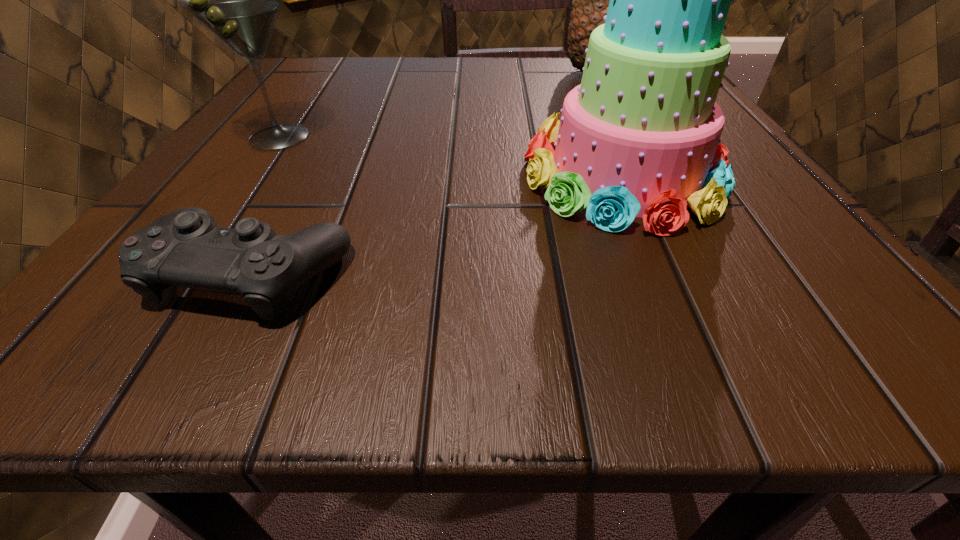
Find the location of `free spot between the martini and the tallest object`. free spot between the martini and the tallest object is located at coordinates (436, 105).

Identify the location of object that is the third nearest to the pineapple. (186, 248).

Select which object is the third closest to the shortest object. Please provide its 2D coordinates. Your answer should be formatted as a tuple, i.e. [(x, y)], where the tuple contains the x and y coordinates of a point satisfying the conditions above.

[(590, 3)]

At what (x,y) coordinates should I click in order to perform the action: click on vacant space that satisfies the following two spatial constraints: 1. on the back side of the cake; 2. on the left side of the shortest object. Please return your answer as a coordinate pair (x, y). Looking at the image, I should click on (305, 174).

This screenshot has height=540, width=960. Identify the location of free point that satisfies the following two spatial constraints: 1. on the front side of the martini; 2. on the right side of the control. (182, 273).